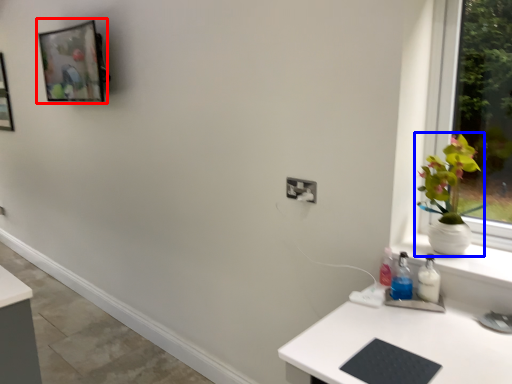
Question: Which object appears closest to the camera in this image, picture frame (highlighted by a red box) or houseplant (highlighted by a blue box)?

Choices:
 (A) picture frame
 (B) houseplant

Answer: (B)